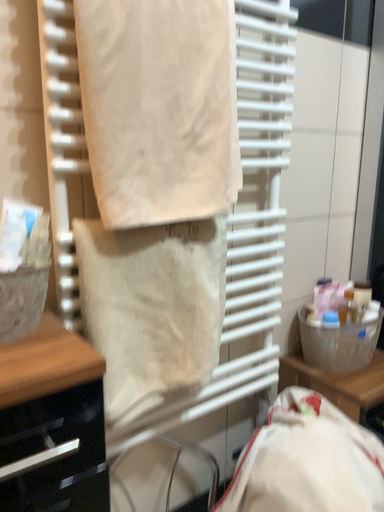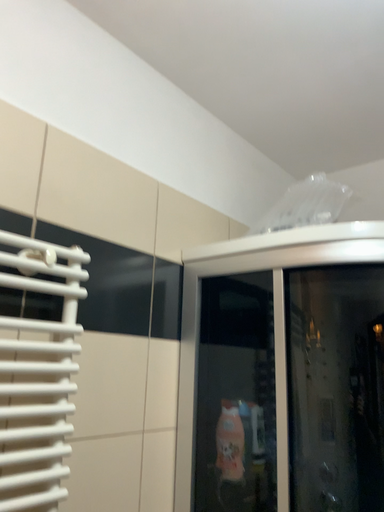
Question: Which way did the camera rotate in the video?

Choices:
 (A) rotated left
 (B) rotated right

Answer: (B)